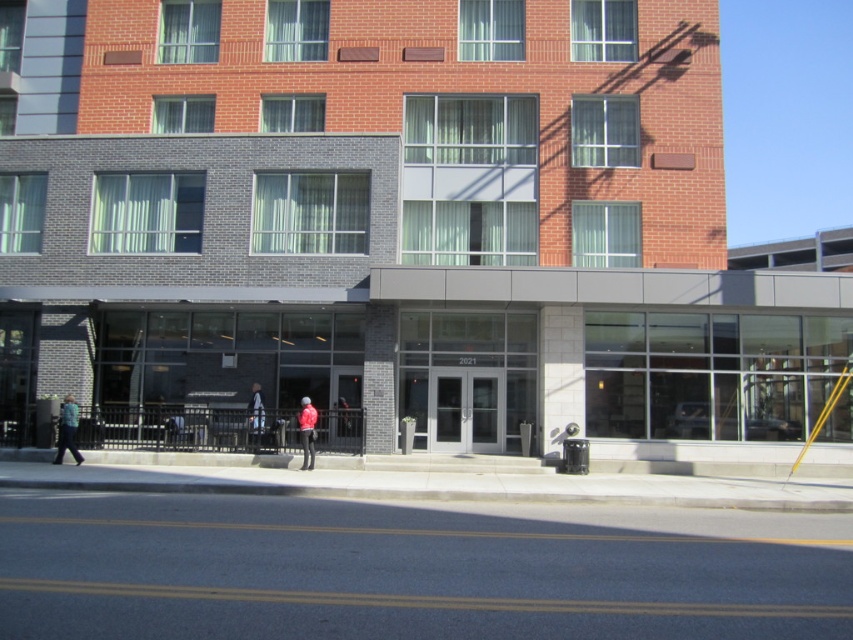
You are a delivery person arriving at this building and see two jackets hanging on hooks near the entrance. The jackets are the green fabric jacket at lower left and the light blue fabric jacket at center. Which jacket is bigger in size?

The green fabric jacket at lower left is larger in size compared to the light blue fabric jacket at center.

You are standing in front of the building and see the green fabric jacket at lower left and the red matte jacket at center. Which jacket is closer to you?

The green fabric jacket at lower left is closer to you because it is further to the viewer than the red matte jacket at center.